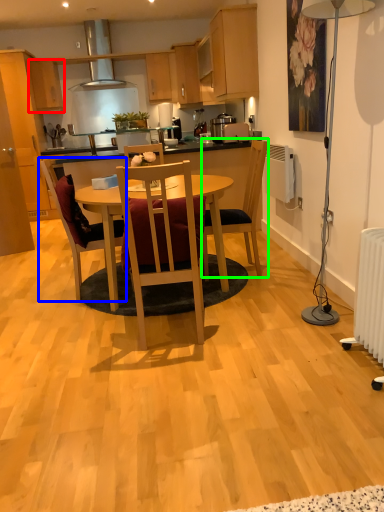
Question: Which object is positioned farthest from cabinetry (highlighted by a red box)? Select from chair (highlighted by a blue box) and chair (highlighted by a green box).

Choices:
 (A) chair
 (B) chair

Answer: (B)